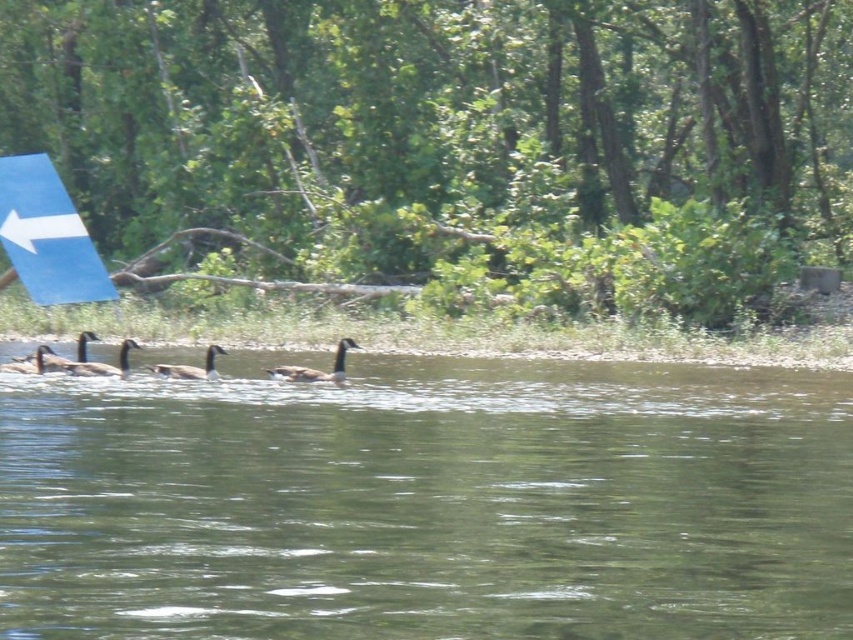
You are standing at the point marked by the coordinates point (428, 502). Looking around, you see the scene described. Which object from the list is directly under your feet?

The point (428, 502) indicates green smooth water at center, so the object directly under your feet is the green smooth water at center.

You are standing at the edge of the water in the scene and want to reach the blue sign with the white arrow on the left side. Which direction should you walk relative to the green smooth water at center?

The green smooth water at center is located at point (428, 502). Since the blue sign is on the left side of the image, you should walk to the left of the green smooth water at center to reach it.

You are a birdwatcher observing the scene. You see two ducks at the center of the image. Which duck is closer to you, the dark brown duck at center or the brown matte duck at center?

The dark brown duck at center is closer to you because the brown matte duck at center is behind it.